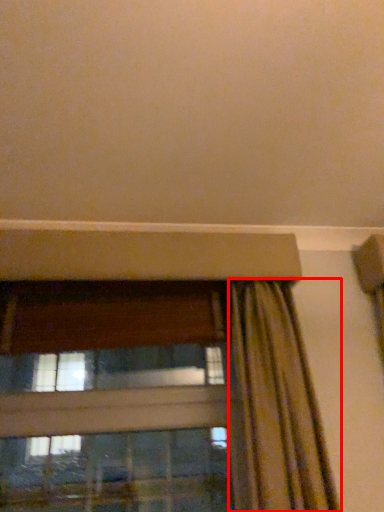
Question: From the image's perspective, what is the correct spatial relationship of curtain (annotated by the red box) in relation to window?

Choices:
 (A) above
 (B) below

Answer: (A)